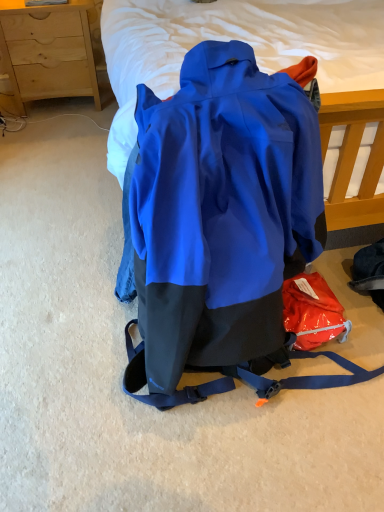
Question: Looking at their shapes, would you say blue matte backpack at center is wider or thinner than wooden chest of drawers at upper left?

Choices:
 (A) thin
 (B) wide

Answer: (B)

Question: Is point (230, 90) closer or farther from the camera than point (59, 31)?

Choices:
 (A) farther
 (B) closer

Answer: (B)

Question: Do you think blue matte backpack at center is within wooden chest of drawers at upper left, or outside of it?

Choices:
 (A) inside
 (B) outside

Answer: (B)

Question: Looking at their shapes, would you say wooden chest of drawers at upper left is wider or thinner than blue matte backpack at center?

Choices:
 (A) wide
 (B) thin

Answer: (B)

Question: Do you think wooden chest of drawers at upper left is within blue matte backpack at center, or outside of it?

Choices:
 (A) inside
 (B) outside

Answer: (B)

Question: Considering the positions of wooden chest of drawers at upper left and blue matte backpack at center in the image, is wooden chest of drawers at upper left taller or shorter than blue matte backpack at center?

Choices:
 (A) short
 (B) tall

Answer: (A)

Question: From the image's perspective, relative to blue matte backpack at center, is wooden chest of drawers at upper left above or below?

Choices:
 (A) below
 (B) above

Answer: (B)